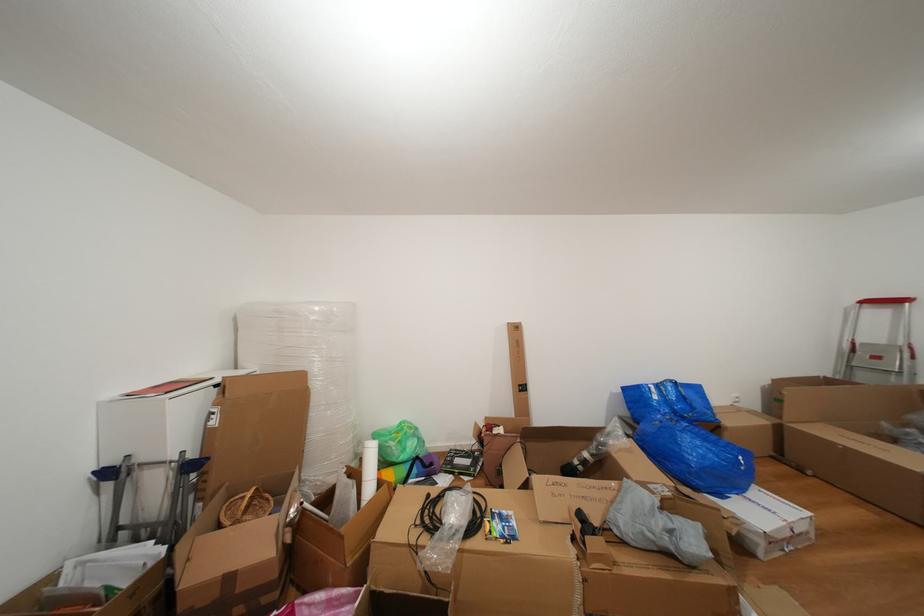
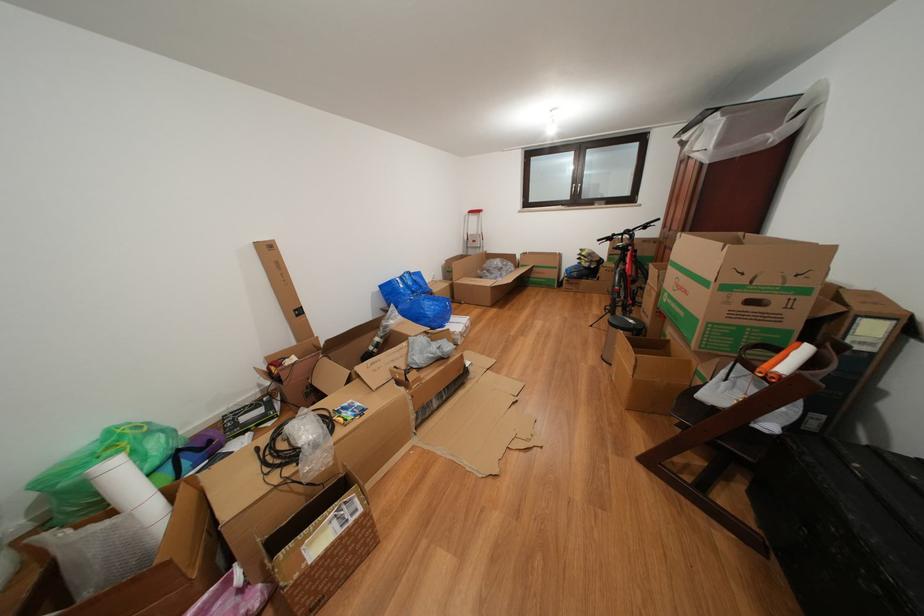
Find the pixel in the second image that matches (x=663, y=402) in the first image.

(409, 291)